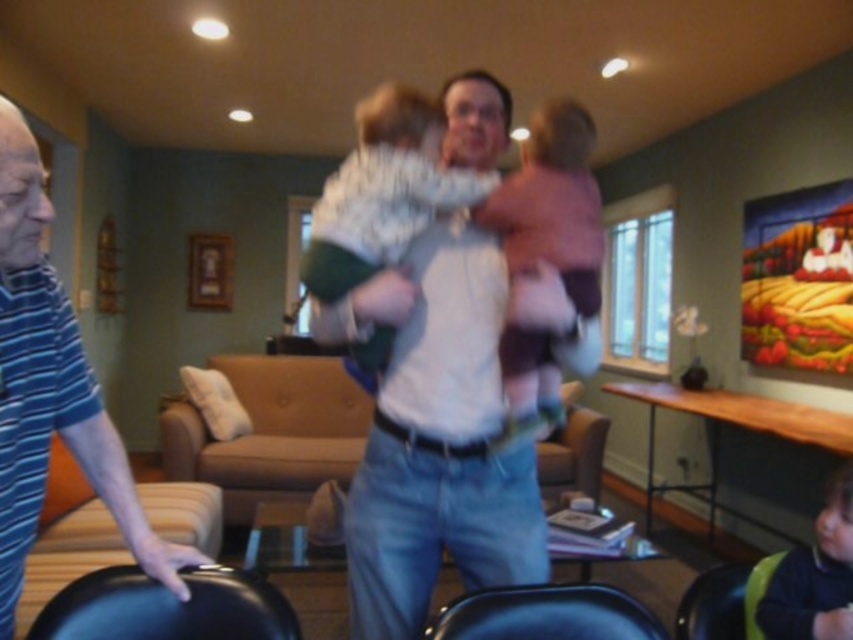
Who is shorter, white cotton shirt at center or black leather chair at lower left?

With less height is black leather chair at lower left.

Does white cotton shirt at center have a greater width compared to black leather chair at lower left?

Correct, the width of white cotton shirt at center exceeds that of black leather chair at lower left.

Describe the element at coordinates (434, 435) in the screenshot. I see `white cotton shirt at center` at that location.

Locate an element on the screen. white cotton shirt at center is located at coordinates (434, 435).

This screenshot has width=853, height=640. What do you see at coordinates (51, 387) in the screenshot?
I see `blue striped shirt at left` at bounding box center [51, 387].

Between point (19, 332) and point (396, 237), which one is positioned behind?

Point (396, 237)

Does point (204, 557) come farther from viewer compared to point (402, 148)?

No, it is in front of (402, 148).

This screenshot has height=640, width=853. What are the coordinates of `blue striped shirt at left` in the screenshot? It's located at (51, 387).

Is blue striped shirt at left smaller than dark green sweater at lower right?

No.

Between blue striped shirt at left and dark green sweater at lower right, which one appears on the left side from the viewer's perspective?

blue striped shirt at left

This screenshot has width=853, height=640. Describe the element at coordinates (51, 387) in the screenshot. I see `blue striped shirt at left` at that location.

Identify the location of blue striped shirt at left. The width and height of the screenshot is (853, 640). click(x=51, y=387).